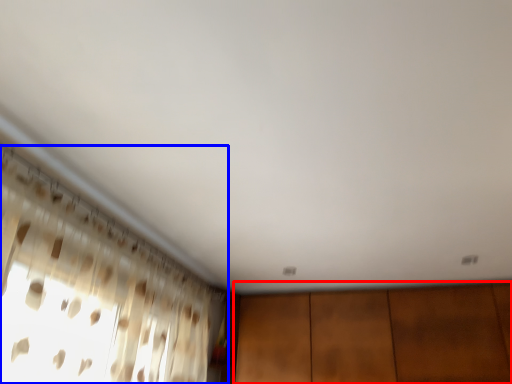
Question: Which object appears farthest to the camera in this image, dresser (highlighted by a red box) or curtain (highlighted by a blue box)?

Choices:
 (A) dresser
 (B) curtain

Answer: (A)